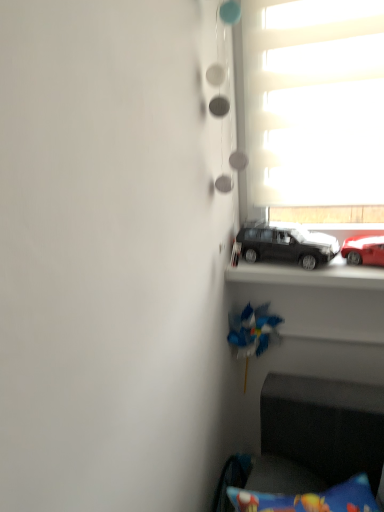
Question: From the image's perspective, is white matte window at upper right positioned above or below matte black car at center, the second car from the right?

Choices:
 (A) above
 (B) below

Answer: (A)

Question: From a real-world perspective, is white matte window at upper right positioned above or below matte black car at center, the 1th car in the left-to-right sequence?

Choices:
 (A) below
 (B) above

Answer: (B)

Question: Estimate the real-world distances between objects in this image. Which object is closer to the matte black car at center, the second car from the right?

Choices:
 (A) velvet dark blue armchair at lower right
 (B) shiny red car at right, which is the second car in left-to-right order
 (C) blue plastic toy at center
 (D) white matte window at upper right

Answer: (B)

Question: Based on their relative distances, which object is farther from the shiny red car at right, the 1th car positioned from the right?

Choices:
 (A) matte black car at center, the second car from the right
 (B) velvet dark blue armchair at lower right
 (C) blue plastic toy at center
 (D) white matte window at upper right

Answer: (B)